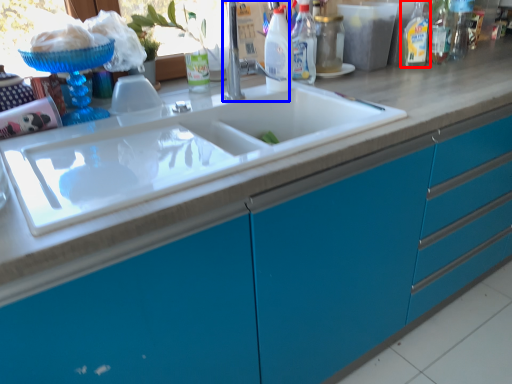
Question: Which object is closer to the camera taking this photo, cleaning product (highlighted by a red box) or faucet (highlighted by a blue box)?

Choices:
 (A) cleaning product
 (B) faucet

Answer: (B)